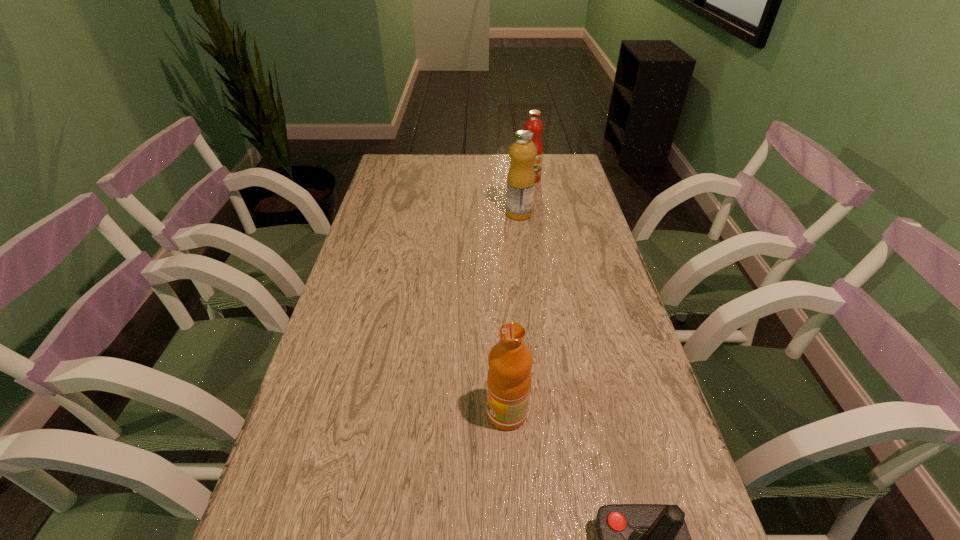
Where is `free point between the third farthest object and the second farthest fruit juice`? This screenshot has height=540, width=960. free point between the third farthest object and the second farthest fruit juice is located at coordinates (513, 313).

I want to click on free space that is in between the farthest fruit juice and the nearest fruit juice, so click(518, 296).

What are the coordinates of `free space between the farthest object and the nearest fruit juice` in the screenshot? It's located at (518, 296).

This screenshot has width=960, height=540. In order to click on free space between the third farthest object and the farthest fruit juice in this screenshot , I will do `click(518, 296)`.

Locate which object ranks third in proximity to the shortest object. Please provide its 2D coordinates. Your answer should be formatted as a tuple, i.e. [(x, y)], where the tuple contains the x and y coordinates of a point satisfying the conditions above.

[(534, 124)]

In order to click on object that is the second closest one to the farthest object in this screenshot , I will do `click(510, 361)`.

Choose which fruit juice is the nearest neighbor to the nearest fruit juice. Please provide its 2D coordinates. Your answer should be formatted as a tuple, i.e. [(x, y)], where the tuple contains the x and y coordinates of a point satisfying the conditions above.

[(521, 177)]

Locate which fruit juice ranks second in proximity to the nearest fruit juice. Please provide its 2D coordinates. Your answer should be formatted as a tuple, i.e. [(x, y)], where the tuple contains the x and y coordinates of a point satisfying the conditions above.

[(534, 124)]

The image size is (960, 540). Find the location of `vacant point that satisfies the following two spatial constraints: 1. on the front label of the farthest object; 2. on the label side of the nearest fruit juice`. vacant point that satisfies the following two spatial constraints: 1. on the front label of the farthest object; 2. on the label side of the nearest fruit juice is located at coordinates (571, 413).

Image resolution: width=960 pixels, height=540 pixels. I want to click on vacant area in the image that satisfies the following two spatial constraints: 1. on the front label of the farthest fruit juice; 2. on the label side of the third farthest object, so click(x=571, y=413).